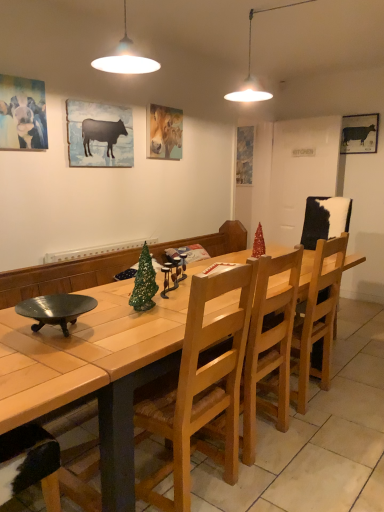
Describe the element at coordinates (94, 371) in the screenshot. I see `wooden table at center` at that location.

Image resolution: width=384 pixels, height=512 pixels. What do you see at coordinates (359, 134) in the screenshot? I see `black matte cow at upper right, which is counted as the second picture frame, starting from the back` at bounding box center [359, 134].

Identify the location of cowhide leather chair at right. click(325, 219).

Identify the location of pastel oil painting of horse at upper center, the 3th picture frame viewed from the right. This screenshot has width=384, height=512. (164, 132).

Describe the element at coordinates (244, 155) in the screenshot. Image resolution: width=384 pixels, height=512 pixels. I see `matte blue painting at center, arranged as the 5th picture frame when viewed from the front` at that location.

In order to face wooden chair at center, the first chair positioned from the back, should I rotate leftwards or rightwards?

Rotate right and turn 13.349 degrees.

The image size is (384, 512). I want to click on light brown wood chair at center, which is the first chair from front to back, so click(x=202, y=385).

Is black matte cow at upper right, the fourth picture frame viewed from the front, far from wooden table at center?

That's right, there is a large distance between black matte cow at upper right, the fourth picture frame viewed from the front, and wooden table at center.

How much distance is there between black matte cow at upper right, which is counted as the 5th picture frame, starting from the left, and wooden table at center?

The distance of black matte cow at upper right, which is counted as the 5th picture frame, starting from the left, from wooden table at center is 11.98 feet.

Does black matte cow at upper right, the fourth picture frame viewed from the front, turn towards wooden table at center?

Yes, black matte cow at upper right, the fourth picture frame viewed from the front, is facing wooden table at center.

From a real-world perspective, which object stands above the other?

black matte cow at upper right, the fourth picture frame viewed from the front.

From the picture: From the image's perspective, is shiny metallic bowl at lower left over black matte cow at upper right, the fourth picture frame viewed from the front?

Actually, shiny metallic bowl at lower left appears below black matte cow at upper right, the fourth picture frame viewed from the front, in the image.

How many degrees apart are the facing directions of shiny metallic bowl at lower left and black matte cow at upper right, which appears as the first picture frame when viewed from the right?

91.2 degrees.

Could you tell me if shiny metallic bowl at lower left is turned towards black matte cow at upper right, which appears as the first picture frame when viewed from the right?

No.

Is wooden table at center spatially inside shiny red christmas tree at center, or outside of it?

wooden table at center is not enclosed by shiny red christmas tree at center.

Between wooden table at center and shiny red christmas tree at center, which one is positioned in front?

wooden table at center is more forward.

How different are the orientations of wooden table at center and shiny red christmas tree at center in degrees?

wooden table at center and shiny red christmas tree at center are facing 37.6 degrees away from each other.

In terms of width, does wooden table at center look wider or thinner when compared to shiny red christmas tree at center?

wooden table at center is wider than shiny red christmas tree at center.

In terms of width, does matte blue painting at center, the 2th picture frame when ordered from right to left, look wider or thinner when compared to matte black cow at upper left, positioned as the fifth picture frame in back-to-front order?

Considering their sizes, matte blue painting at center, the 2th picture frame when ordered from right to left, looks broader than matte black cow at upper left, positioned as the fifth picture frame in back-to-front order.

Considering the relative sizes of matte blue painting at center, positioned as the first picture frame in back-to-front order, and matte black cow at upper left, the first picture frame positioned from the left, in the image provided, is matte blue painting at center, positioned as the first picture frame in back-to-front order, taller than matte black cow at upper left, the first picture frame positioned from the left,?

Indeed, matte blue painting at center, positioned as the first picture frame in back-to-front order, has a greater height compared to matte black cow at upper left, the first picture frame positioned from the left.

Is point (237, 169) behind point (11, 78)?

Yes, it is.

Considering the relative sizes of cowhide leather chair at right and pastel oil painting of horse at upper center, the 3th picture frame viewed from the right, in the image provided, is cowhide leather chair at right taller than pastel oil painting of horse at upper center, the 3th picture frame viewed from the right,?

Yes, cowhide leather chair at right is taller than pastel oil painting of horse at upper center, the 3th picture frame viewed from the right.

Is cowhide leather chair at right looking in the opposite direction of pastel oil painting of horse at upper center, the 3th picture frame viewed from the right?

No, cowhide leather chair at right is not facing the opposite direction of pastel oil painting of horse at upper center, the 3th picture frame viewed from the right.

Measure the distance from cowhide leather chair at right to pastel oil painting of horse at upper center, the 3th picture frame viewed from the right.

cowhide leather chair at right and pastel oil painting of horse at upper center, the 3th picture frame viewed from the right, are 4.56 feet apart from each other.

Does cowhide leather chair at right have a smaller size compared to pastel oil painting of horse at upper center, the third picture frame viewed from the back?

Actually, cowhide leather chair at right might be larger than pastel oil painting of horse at upper center, the third picture frame viewed from the back.

Considering the sizes of silhouette paper cow at upper left, the 4th picture frame in the right-to-left sequence, and shiny metallic bowl at lower left in the image, is silhouette paper cow at upper left, the 4th picture frame in the right-to-left sequence, taller or shorter than shiny metallic bowl at lower left?

Clearly, silhouette paper cow at upper left, the 4th picture frame in the right-to-left sequence, is taller compared to shiny metallic bowl at lower left.

Does silhouette paper cow at upper left, which is counted as the fourth picture frame, starting from the back, turn towards shiny metallic bowl at lower left?

No, silhouette paper cow at upper left, which is counted as the fourth picture frame, starting from the back, is not turned towards shiny metallic bowl at lower left.

From the image's perspective, is silhouette paper cow at upper left, the 4th picture frame in the right-to-left sequence, below shiny metallic bowl at lower left?

No.

Considering the sizes of silhouette paper cow at upper left, the 4th picture frame in the right-to-left sequence, and wooden table at center in the image, is silhouette paper cow at upper left, the 4th picture frame in the right-to-left sequence, bigger or smaller than wooden table at center?

Considering their sizes, silhouette paper cow at upper left, the 4th picture frame in the right-to-left sequence, takes up less space than wooden table at center.

Is wooden table at center at the back of silhouette paper cow at upper left, the 4th picture frame in the right-to-left sequence?

That's not correct — silhouette paper cow at upper left, the 4th picture frame in the right-to-left sequence, is not looking away from wooden table at center.

Is silhouette paper cow at upper left, acting as the second picture frame starting from the front, with wooden table at center?

silhouette paper cow at upper left, acting as the second picture frame starting from the front, and wooden table at center are not in contact.

Find the location of a particular element. This screenshot has height=512, width=384. desk on the left of black matte cow at upper right, which appears as the first picture frame when viewed from the right is located at coordinates (94, 371).

Image resolution: width=384 pixels, height=512 pixels. In order to click on bowl that appears below the black matte cow at upper right, which appears as the first picture frame when viewed from the right (from the image's perspective) in this screenshot , I will do `click(56, 309)`.

When comparing their distances from light brown wood chair at center, which appears as the second chair when viewed from the back, does wooden chair at center, which is counted as the 2th chair, starting from the front, or shiny metallic bowl at lower left seem closer?

shiny metallic bowl at lower left is closer to light brown wood chair at center, which appears as the second chair when viewed from the back.

Looking at the image, which one is located closer to black matte cow at upper right, which is counted as the second picture frame, starting from the back, matte black cow at upper left, acting as the 5th picture frame starting from the right, or matte blue painting at center, the 2th picture frame when ordered from right to left?

matte blue painting at center, the 2th picture frame when ordered from right to left, lies closer to black matte cow at upper right, which is counted as the second picture frame, starting from the back, than the other object.

Looking at the image, which one is located further to wooden chair at center, the first chair positioned from the back, silhouette paper cow at upper left, which is counted as the fourth picture frame, starting from the back, or matte blue painting at center, which is counted as the fourth picture frame, starting from the left?

matte blue painting at center, which is counted as the fourth picture frame, starting from the left, is further to wooden chair at center, the first chair positioned from the back.

Based on their spatial positions, is black matte cow at upper right, which is counted as the second picture frame, starting from the back, or silhouette paper cow at upper left, arranged as the second picture frame when viewed from the left, further from light brown wood chair at center, the 2th chair when ordered from right to left?

The object further to light brown wood chair at center, the 2th chair when ordered from right to left, is black matte cow at upper right, which is counted as the second picture frame, starting from the back.

Which object lies nearer to the anchor point black matte cow at upper right, which is counted as the second picture frame, starting from the back, pastel oil painting of horse at upper center, the third picture frame viewed from the back, or shiny metallic bowl at lower left?

pastel oil painting of horse at upper center, the third picture frame viewed from the back, is closer to black matte cow at upper right, which is counted as the second picture frame, starting from the back.

Looking at the image, which one is located further to shiny red christmas tree at center, pastel oil painting of horse at upper center, the third picture frame viewed from the back, or cowhide leather chair at right?

pastel oil painting of horse at upper center, the third picture frame viewed from the back, is positioned further to the anchor shiny red christmas tree at center.

Which object lies further to the anchor point matte blue painting at center, which is counted as the fourth picture frame, starting from the left, black matte cow at upper right, which appears as the first picture frame when viewed from the right, or wooden table at center?

Based on the image, wooden table at center appears to be further to matte blue painting at center, which is counted as the fourth picture frame, starting from the left.

Estimate the real-world distances between objects in this image. Which object is closer to matte blue painting at center, the 2th picture frame when ordered from right to left, cowhide leather chair at right or silhouette paper cow at upper left, which is counted as the fourth picture frame, starting from the back?

cowhide leather chair at right lies closer to matte blue painting at center, the 2th picture frame when ordered from right to left, than the other object.

Locate an element on the screen. This screenshot has width=384, height=512. armchair between silhouette paper cow at upper left, arranged as the second picture frame when viewed from the left, and matte blue painting at center, which is counted as the fourth picture frame, starting from the left, from front to back is located at coordinates (325, 219).

Identify the location of armchair between wooden table at center and matte blue painting at center, arranged as the 5th picture frame when viewed from the front, in the front-back direction. pyautogui.click(x=325, y=219).

Find the location of a particular element. chair between shiny metallic bowl at lower left and pastel oil painting of horse at upper center, which ranks as the 3th picture frame in front-to-back order, along the z-axis is located at coordinates (318, 317).

The width and height of the screenshot is (384, 512). What are the coordinates of `chair located between matte black cow at upper left, the 1th picture frame viewed from the front, and shiny red christmas tree at center in the left-right direction` in the screenshot? It's located at (202, 385).